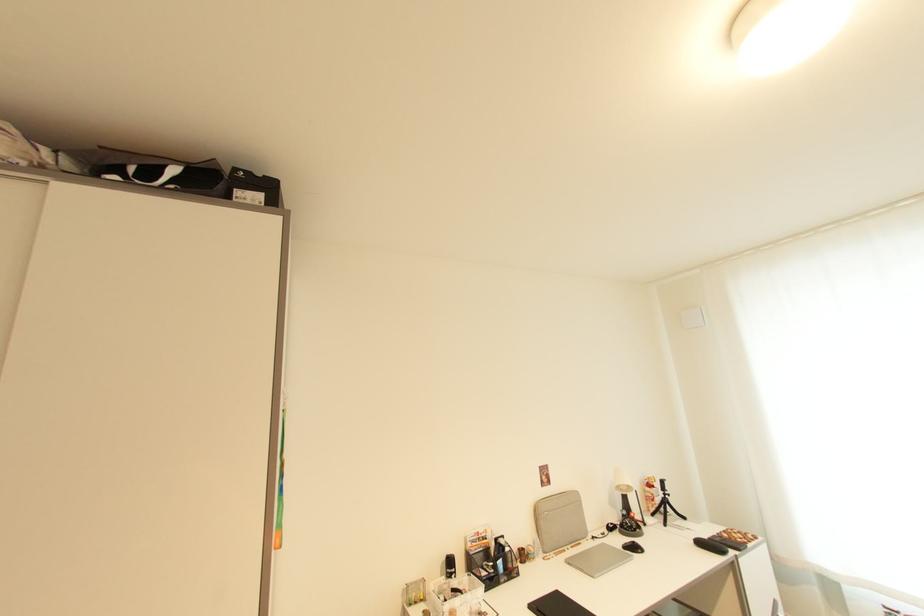
What do you see at coordinates (630, 525) in the screenshot? I see `the lamp rotary dial` at bounding box center [630, 525].